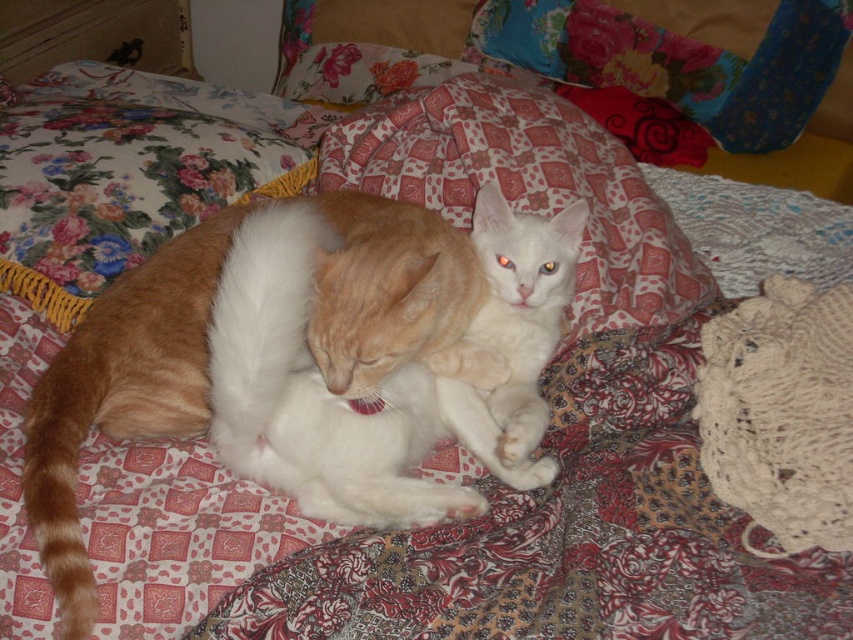
Question: Is floral fabric pillow at upper center thinner than white matte cat at center?

Choices:
 (A) no
 (B) yes

Answer: (A)

Question: Considering the real-world distances, which object is closest to the white matte cat at center?

Choices:
 (A) floral fabric pillow at upper center
 (B) orange fur cat at center

Answer: (B)

Question: From the image, what is the correct spatial relationship of orange fur cat at center in relation to white matte cat at center?

Choices:
 (A) right
 (B) left

Answer: (B)

Question: Which of the following is the closest to the observer?

Choices:
 (A) white matte cat at center
 (B) floral fabric pillow at upper center
 (C) orange fur cat at center

Answer: (C)

Question: Which object is farther from the camera taking this photo?

Choices:
 (A) orange fur cat at center
 (B) floral fabric pillow at upper center
 (C) white matte cat at center

Answer: (B)

Question: Is floral fabric pillow at upper center bigger than white matte cat at center?

Choices:
 (A) yes
 (B) no

Answer: (A)